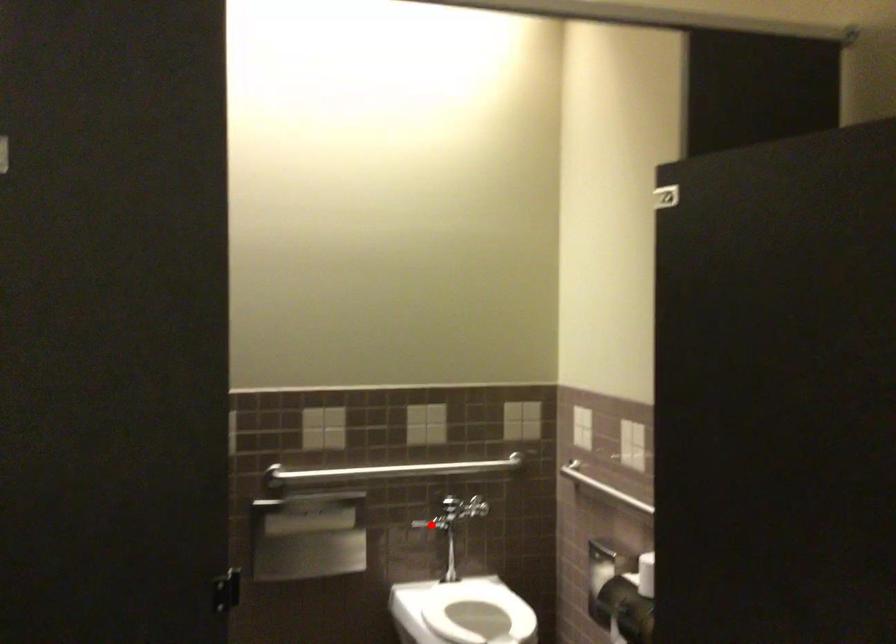
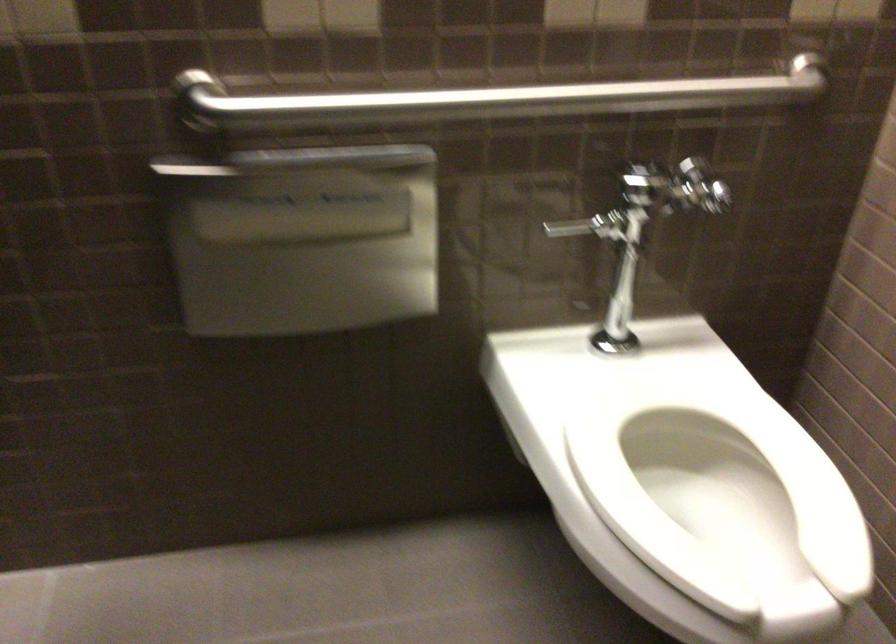
In the second image, find the point that corresponds to the highlighted location in the first image.

(589, 225)